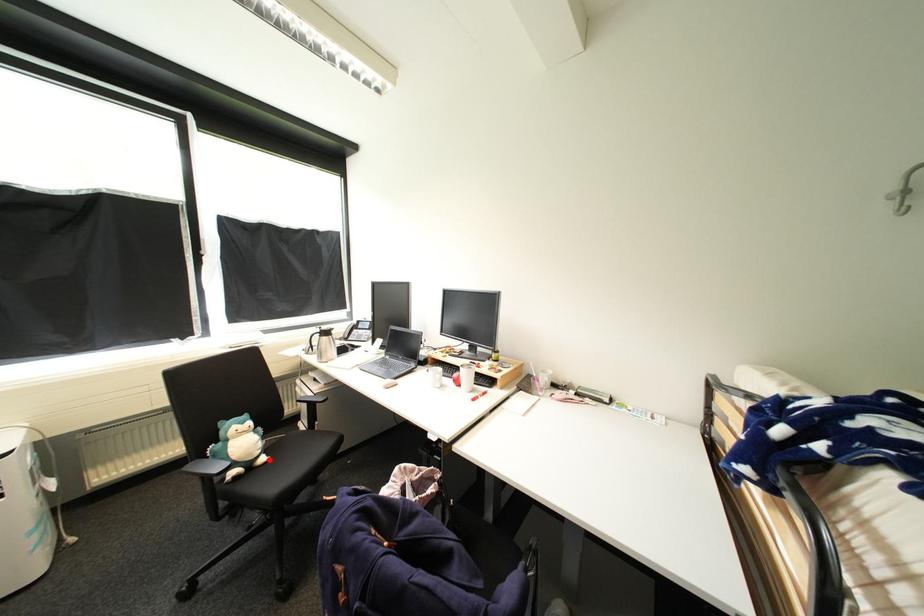
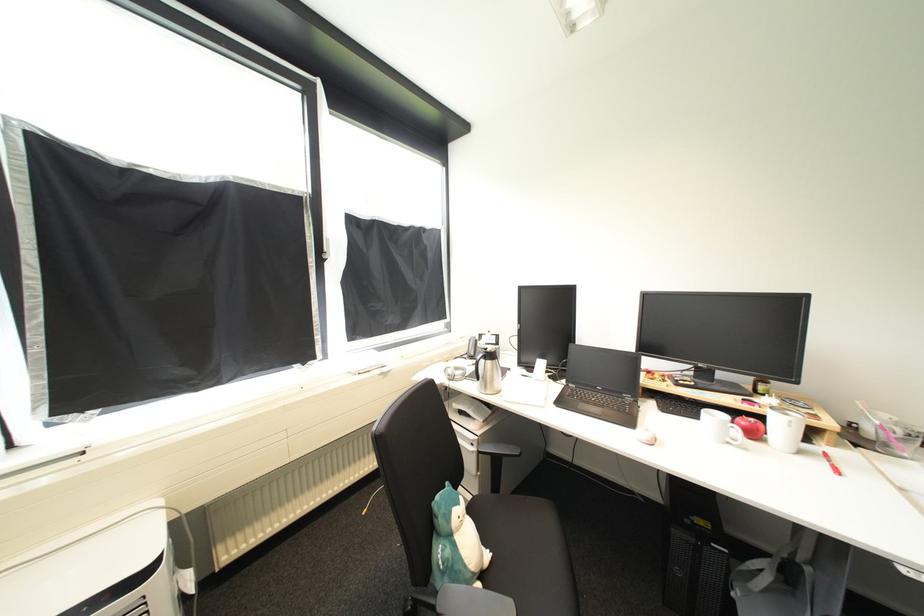
The point at the highlighted location is marked in the first image. Where is the corresponding point in the second image?

(493, 557)